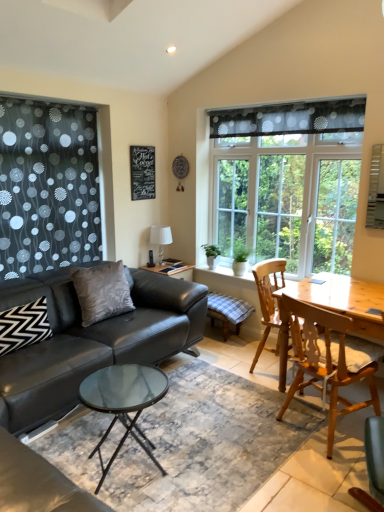
Question: From a real-world perspective, is matte black chair at lower right, the first chair in the front-to-back sequence, above or below satin gray pillow at center, which is the first pillow from right to left?

Choices:
 (A) below
 (B) above

Answer: (A)

Question: From the image's perspective, is matte black chair at lower right, which is the 3th chair in back-to-front order, positioned above or below satin gray pillow at center, which is the first pillow from right to left?

Choices:
 (A) below
 (B) above

Answer: (A)

Question: Considering the real-world distances, which object is closest to the translucent polka dot curtain at upper center?

Choices:
 (A) clear glass window at center
 (B) wooden chair at right, acting as the 1th chair starting from the back
 (C) satin gray pillow at center, which is the first pillow from right to left
 (D) white glossy lampshade at upper center
 (E) matte black chair at lower right, the first chair in the front-to-back sequence

Answer: (A)

Question: Based on their relative distances, which object is farther from the translucent polka dot curtain at upper center?

Choices:
 (A) chalkboard at upper center
 (B) white glossy lampshade at upper center
 (C) wooden chair at right, acting as the 1th chair starting from the back
 (D) light brown wooden chair at right, the 2th chair positioned from the back
 (E) clear glass window at center

Answer: (D)